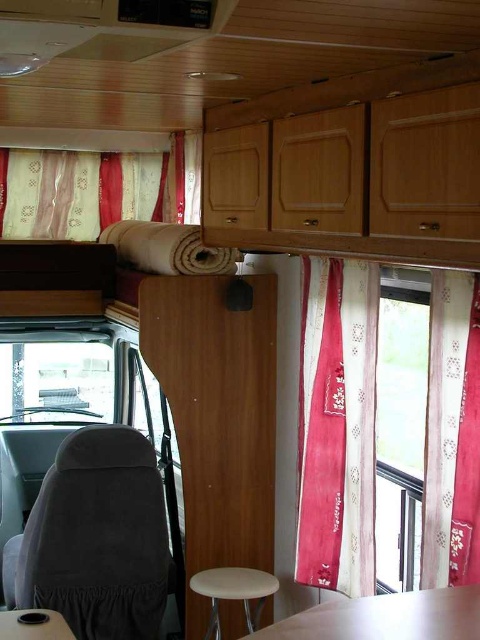
Question: Does white glossy table at lower center appear under transparent glass window at left?

Choices:
 (A) no
 (B) yes

Answer: (B)

Question: Among these objects, which one is farthest from the camera?

Choices:
 (A) white glossy table at lower left
 (B) patterned fabric curtain at upper left
 (C) pink fabric curtain at center

Answer: (B)

Question: Does patterned fabric curtain at upper left appear over transparent glass window at left?

Choices:
 (A) no
 (B) yes

Answer: (B)

Question: Which point is closer to the camera?

Choices:
 (A) white glossy table at lower left
 (B) white glossy table at lower center
 (C) beige fabric stool at lower center
 (D) gray fabric chair at lower left

Answer: (B)

Question: Estimate the real-world distances between objects in this image. Which object is closer to the white glossy table at lower left?

Choices:
 (A) transparent glass window at left
 (B) white glossy table at lower center

Answer: (B)

Question: Can you confirm if pink fabric curtain at center is bigger than beige fabric stool at lower center?

Choices:
 (A) yes
 (B) no

Answer: (A)